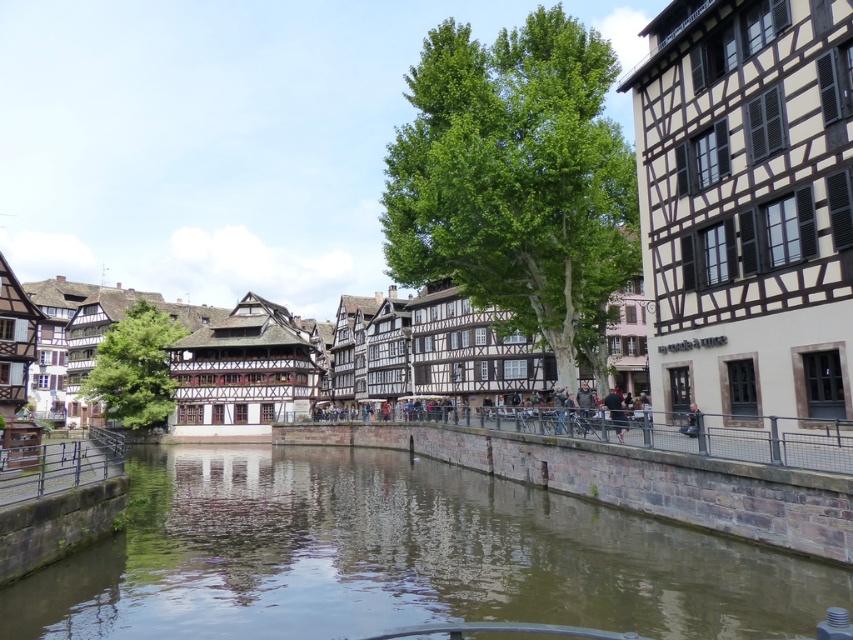
Question: Does white timber-framed building at center have a larger size compared to rustic metal railing at lower left?

Choices:
 (A) yes
 (B) no

Answer: (A)

Question: Can you confirm if brown stone river at center is thinner than rustic metal railing at lower left?

Choices:
 (A) no
 (B) yes

Answer: (A)

Question: Which object appears farthest from the camera in this image?

Choices:
 (A) rustic metal railing at lower left
 (B) white timber-framed building at center
 (C) white wood timbered house at center

Answer: (C)

Question: Which point is farther to the camera?

Choices:
 (A) (77, 440)
 (B) (30, 580)
 (C) (196, 221)
 (D) (686, 426)

Answer: (C)

Question: Which of the following is the closest to the observer?

Choices:
 (A) light blue jeans at lower right
 (B) white wood timbered house at center
 (C) rustic metal railing at lower left
 (D) white timber-framed building at center

Answer: (C)

Question: Does brown stone river at center appear over light blue jeans at lower right?

Choices:
 (A) yes
 (B) no

Answer: (B)